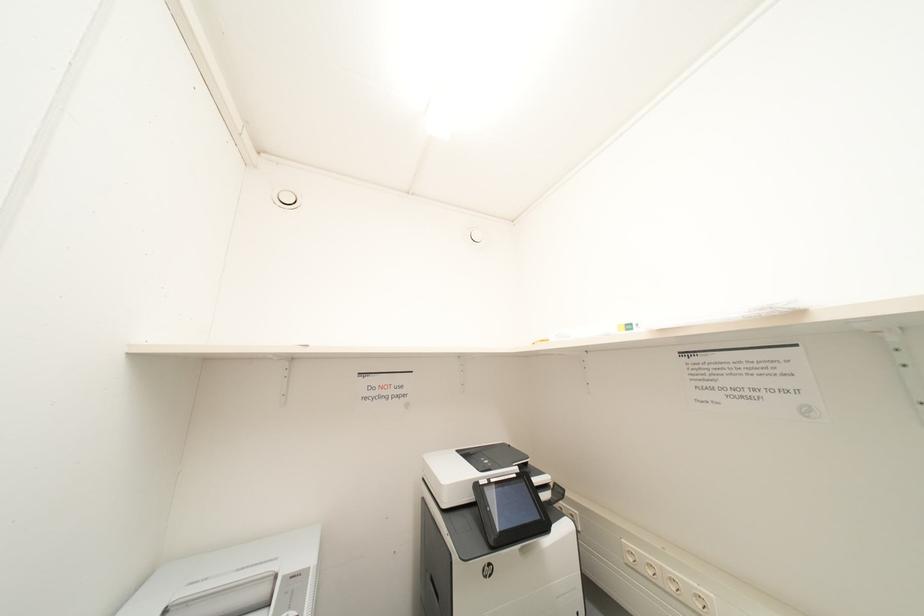
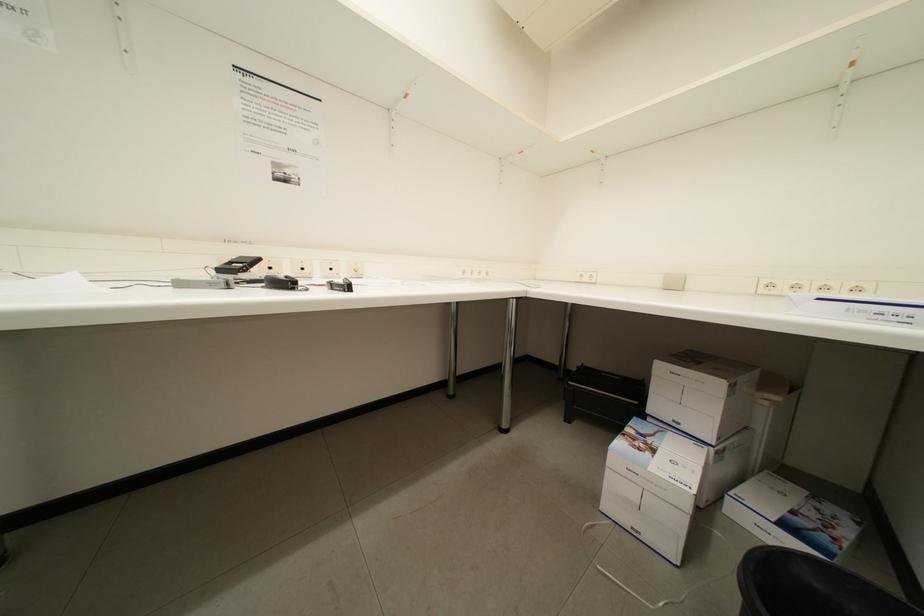
Question: The first image is from the beginning of the video and the second image is from the end. How did the camera likely rotate when shooting the video?

Choices:
 (A) Left
 (B) Right
 (C) Up
 (D) Down

Answer: (B)